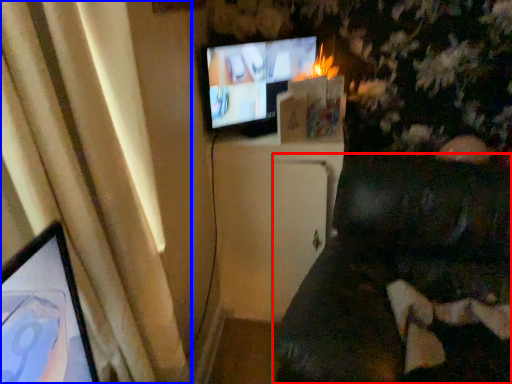
Question: Which object is further to the camera taking this photo, furniture (highlighted by a red box) or curtain (highlighted by a blue box)?

Choices:
 (A) furniture
 (B) curtain

Answer: (B)